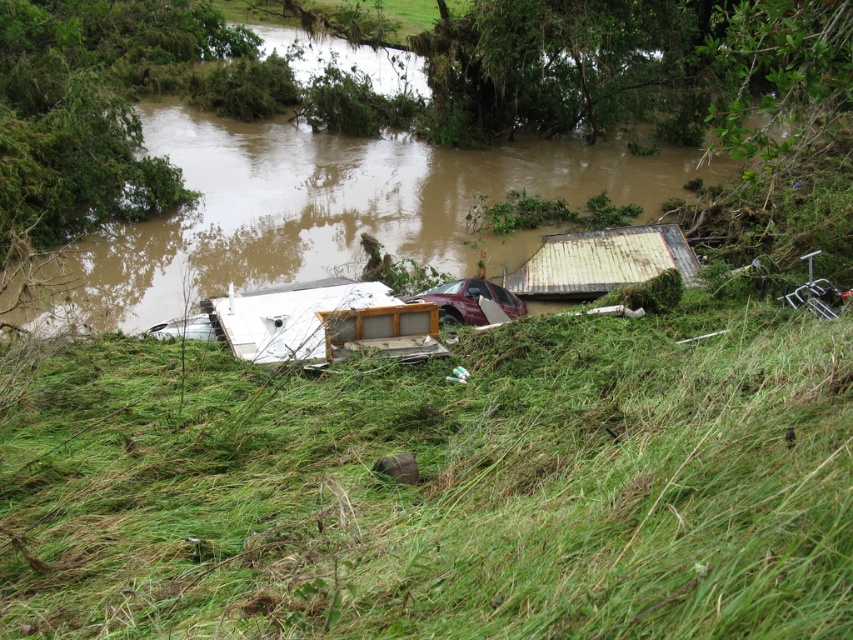
Can you confirm if white matte cabinet at center is smaller than rusty corrugated metal hut at center-right?

Incorrect, white matte cabinet at center is not smaller in size than rusty corrugated metal hut at center-right.

What do you see at coordinates (325, 323) in the screenshot?
I see `white matte cabinet at center` at bounding box center [325, 323].

Locate an element on the screen. This screenshot has width=853, height=640. white matte cabinet at center is located at coordinates (325, 323).

Is point (531, 317) in front of point (509, 285)?

That is True.

Who is taller, green grassy at center or rusty corrugated metal hut at center-right?

rusty corrugated metal hut at center-right

Is point (103, 333) closer to camera compared to point (567, 234)?

Yes, it is.

Where is `green grassy at center`? green grassy at center is located at coordinates (436, 484).

Is point (206, 608) positioned after point (306, 340)?

That is False.

Which is more to the left, green grassy at center or white matte cabinet at center?

white matte cabinet at center

Is point (462, 504) positioned behind point (334, 323)?

No, (462, 504) is in front of (334, 323).

Where is `green grassy at center`? This screenshot has height=640, width=853. green grassy at center is located at coordinates (436, 484).